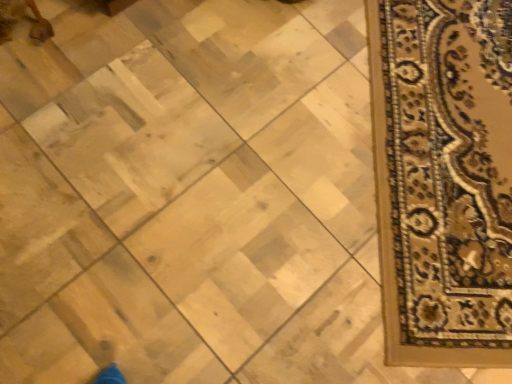
The image size is (512, 384). I want to click on vacant space in carpet with intricate patterns at right (from a real-world perspective), so click(x=457, y=168).